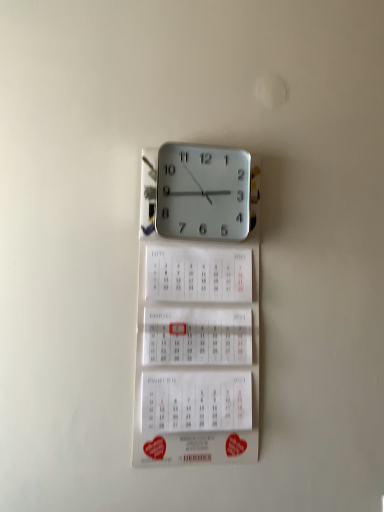
Measure the distance between point (x=149, y=217) and camera.

They are 1.05 meters apart.

Image resolution: width=384 pixels, height=512 pixels. What do you see at coordinates (204, 192) in the screenshot? I see `metallic square clock at center` at bounding box center [204, 192].

You are a GUI agent. You are given a task and a screenshot of the screen. Output one action in this format:
    pyautogui.click(x=<x>, y=<y>)
    Task: Click on the metallic square clock at center
    
    Given the screenshot: What is the action you would take?
    pyautogui.click(x=204, y=192)

Locate an element on the screen. metallic square clock at center is located at coordinates (204, 192).